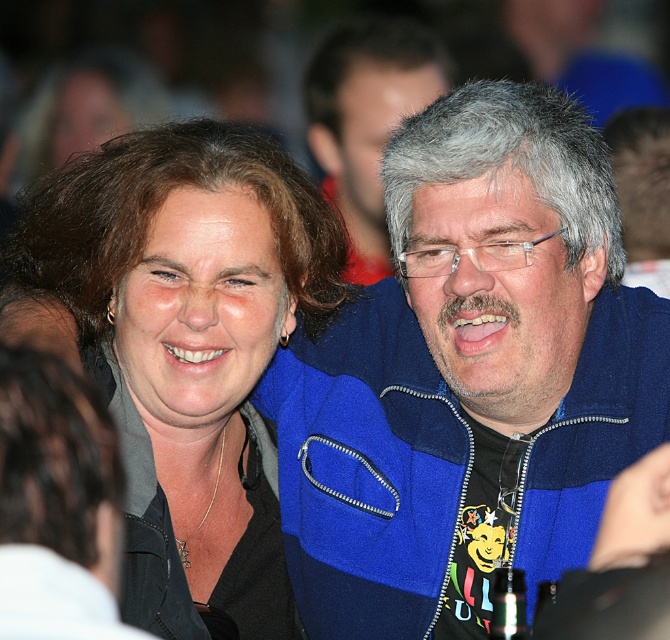
You are a photographer trying to capture a closeup of the blue fleece jacket at center. Given that the camera you are using has a focal length of 50mm and you are currently 2 meters away from the jacket, can you estimate whether the jacket will fill the frame adequately? Assume the jacket occupies 30cm in height and the camera sensor has a height of 24mm.

The blue fleece jacket at center is positioned at point coordinates, but without specific spatial relations to other objects or the frame, it is impossible to determine if it will fill the camera frame adequately based on the given information.

In the scene shown: You are at a party and want to give a gift to the person wearing the larger blue fleece jacket. Which one should you approach, the person with the blue fleece jacket at center or the blue fleece jacket at upper center?

You should approach the person wearing the blue fleece jacket at upper center because it is larger than the blue fleece jacket at center.